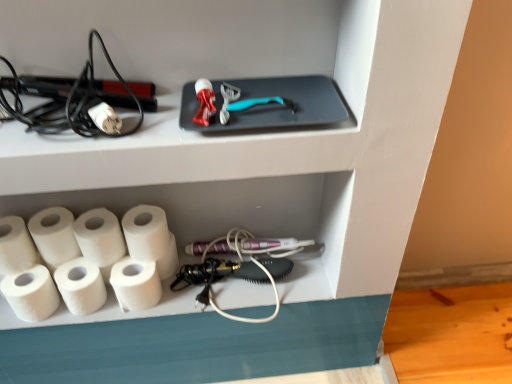
You are a GUI agent. You are given a task and a screenshot of the screen. Output one action in this format:
    pyautogui.click(x=<x>, y=<y>)
    Task: Click on the vacant space underneath black plastic hair straightener at left (from a real-world perspective)
    
    Given the screenshot: What is the action you would take?
    pyautogui.click(x=59, y=120)